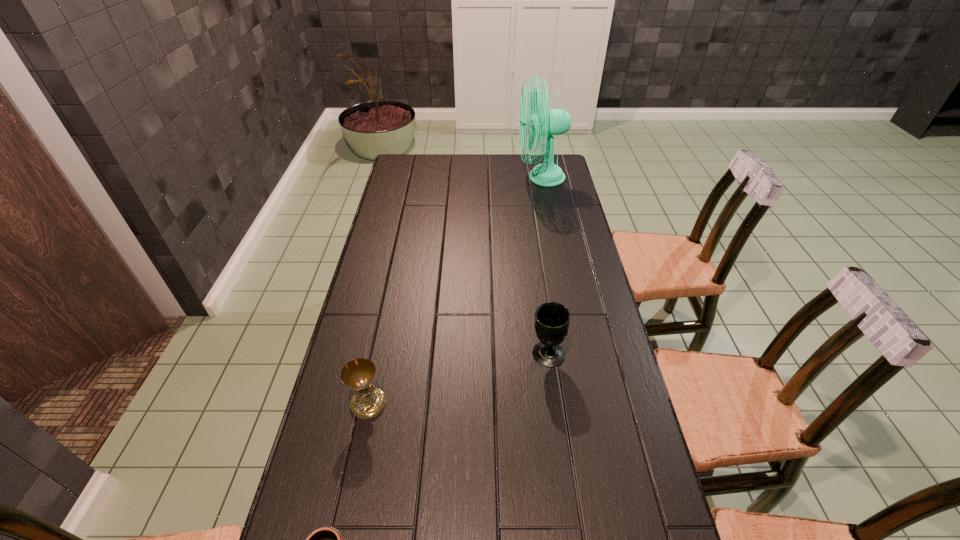
Where is `free space located 0.310m on the back of the third farthest object`? The image size is (960, 540). free space located 0.310m on the back of the third farthest object is located at coordinates (389, 304).

You are a GUI agent. You are given a task and a screenshot of the screen. Output one action in this format:
    pyautogui.click(x=<x>, y=<y>)
    Task: Click on the object located at the far edge
    This screenshot has height=540, width=960.
    Given the screenshot: What is the action you would take?
    pyautogui.click(x=549, y=122)

Locate an element on the screen. Image resolution: width=960 pixels, height=540 pixels. object located at the left edge is located at coordinates (368, 401).

The width and height of the screenshot is (960, 540). I want to click on fan located in the right edge section of the desktop, so click(x=549, y=122).

The image size is (960, 540). Identify the location of chalice at the right edge. (552, 319).

This screenshot has height=540, width=960. I want to click on object that is positioned at the far right corner, so click(x=549, y=122).

Identify the location of vacant position at the far edge of the desktop. (474, 166).

Find the location of a particular element. Image resolution: width=960 pixels, height=540 pixels. free space at the left edge of the desktop is located at coordinates (354, 430).

Identify the location of vacant space at the right edge. The height and width of the screenshot is (540, 960). (561, 277).

Image resolution: width=960 pixels, height=540 pixels. In the image, there is a desktop. Find the location of `vacant area at the far left corner`. vacant area at the far left corner is located at coordinates (426, 170).